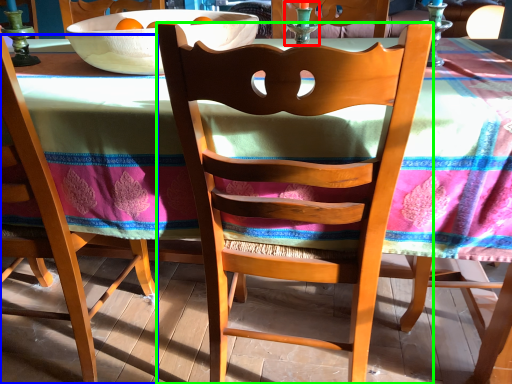
Question: Considering the real-world distances, which object is farthest from candle holder (highlighted by a red box)? chair (highlighted by a blue box) or chair (highlighted by a green box)?

Choices:
 (A) chair
 (B) chair

Answer: (A)